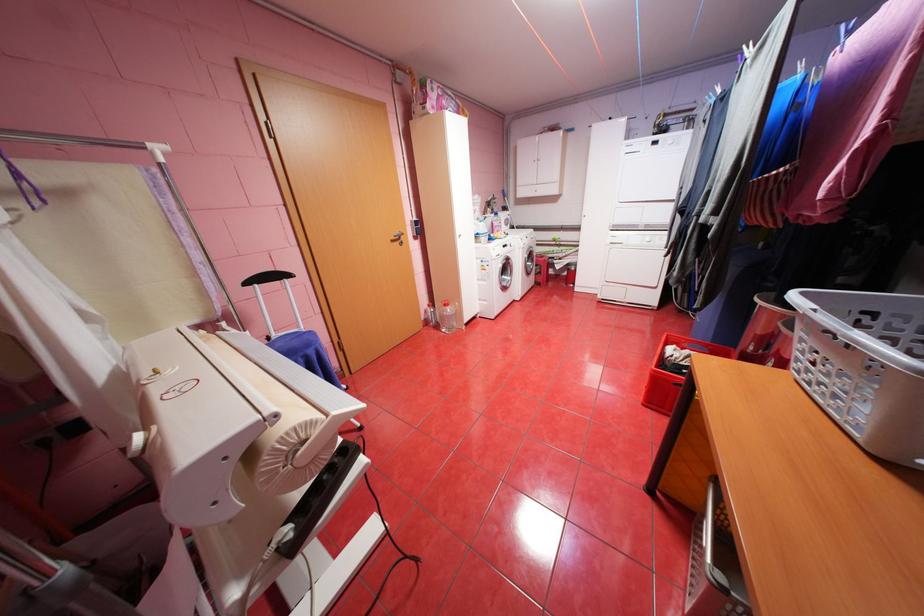
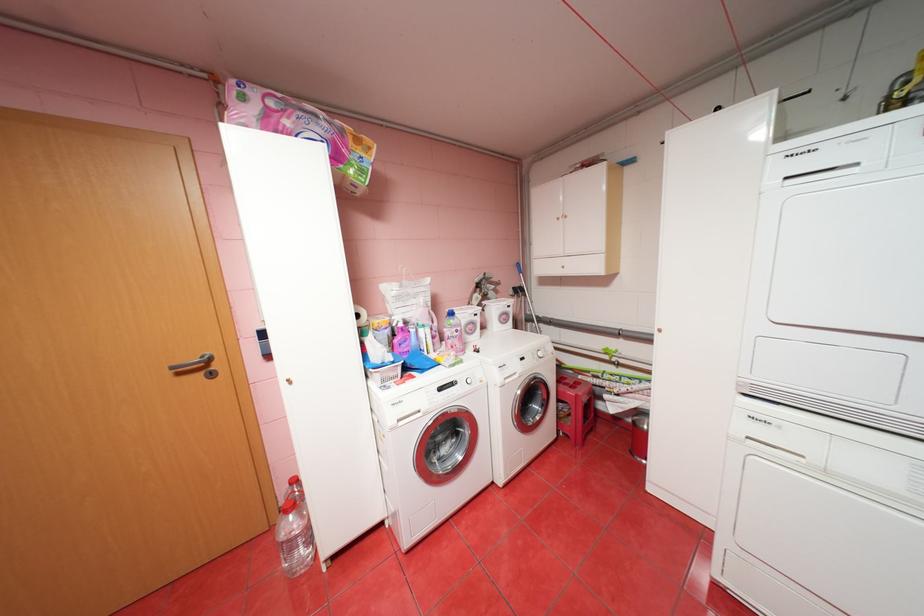
In a continuous first-person perspective shot, in which direction is the camera moving?

The movement direction of the cameraman is right, forward.